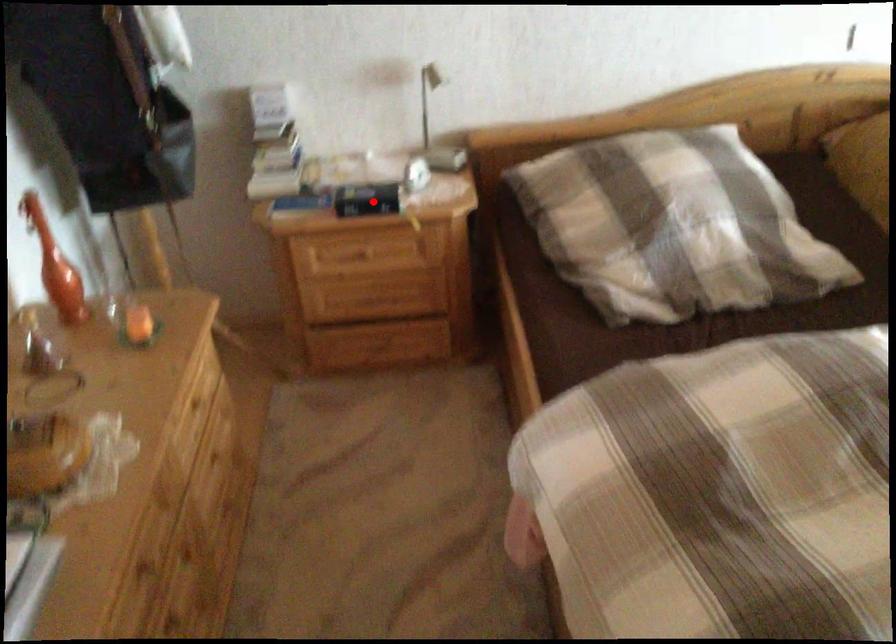
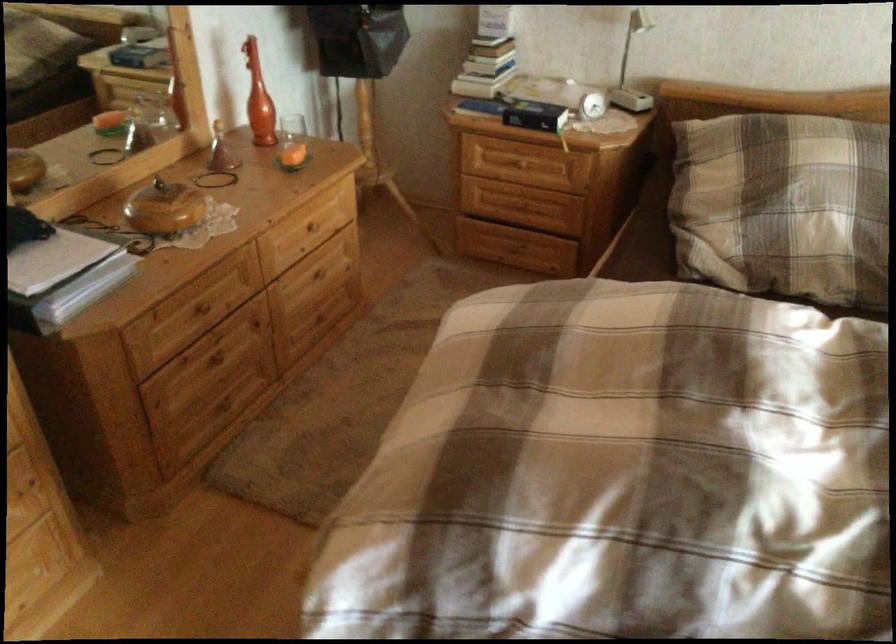
Question: I am providing you with two images of the same scene from different viewpoints. Given a red point in image1, look at the same physical point in image2. Is it:

Choices:
 (A) Closer to the viewpoint
 (B) Farther from the viewpoint

Answer: (B)